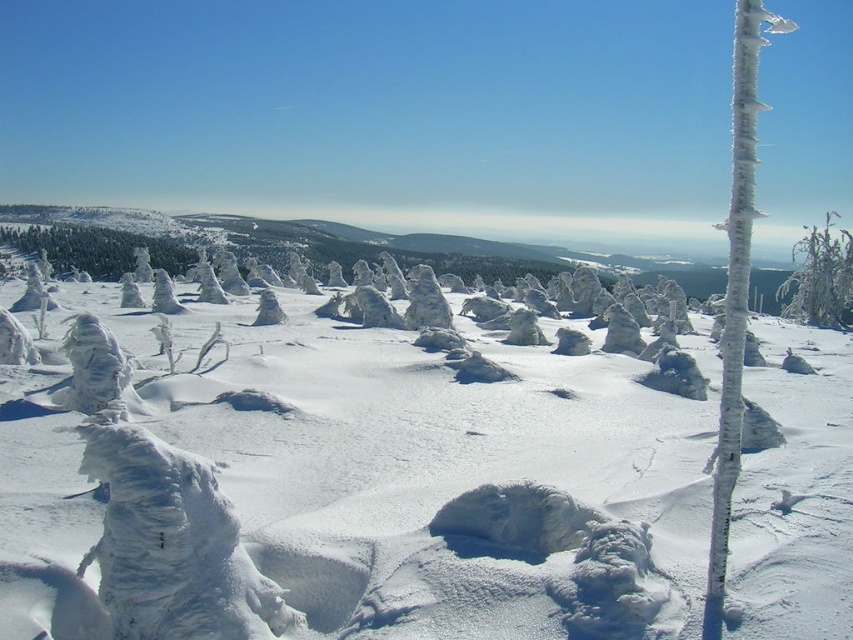
Question: Can you confirm if white frosty tree at left is positioned to the right of icy white tree at right?

Choices:
 (A) yes
 (B) no

Answer: (B)

Question: Based on their relative distances, which object is farther from the icy white pole at right?

Choices:
 (A) white frosty tree at left
 (B) white frosty trees at center
 (C) icy white tree at right

Answer: (A)

Question: Which object is farther from the camera taking this photo?

Choices:
 (A) icy white tree at right
 (B) white frosty tree at left
 (C) icy white pole at right

Answer: (B)

Question: Is white frosty trees at center to the right of white frosty tree at left from the viewer's perspective?

Choices:
 (A) no
 (B) yes

Answer: (B)

Question: Which point is farther to the camera?

Choices:
 (A) white frosty trees at center
 (B) white frosty tree at left
 (C) icy white pole at right

Answer: (B)

Question: Is white frosty trees at center wider than icy white tree at right?

Choices:
 (A) yes
 (B) no

Answer: (B)